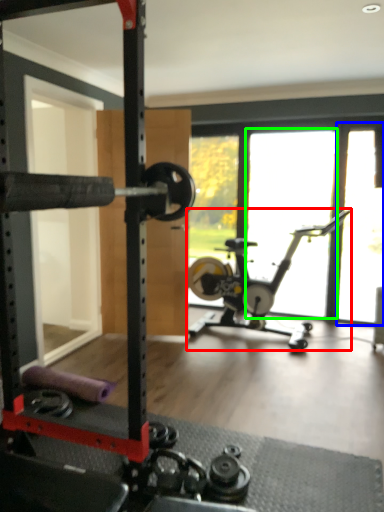
Question: Which object is the farthest from stationary bicycle (highlighted by a red box)? Choose among these: window screen (highlighted by a blue box) or window (highlighted by a green box).

Choices:
 (A) window screen
 (B) window

Answer: (B)